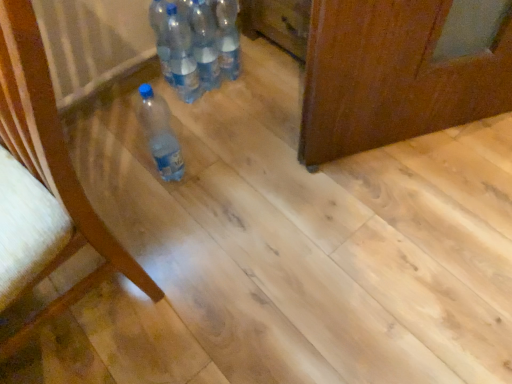
Where is `free space that is in between matte wood chair at left and clear plastic bottle at center, which is counted as the second bottle, starting from the bottom`? This screenshot has width=512, height=384. free space that is in between matte wood chair at left and clear plastic bottle at center, which is counted as the second bottle, starting from the bottom is located at coordinates (154, 189).